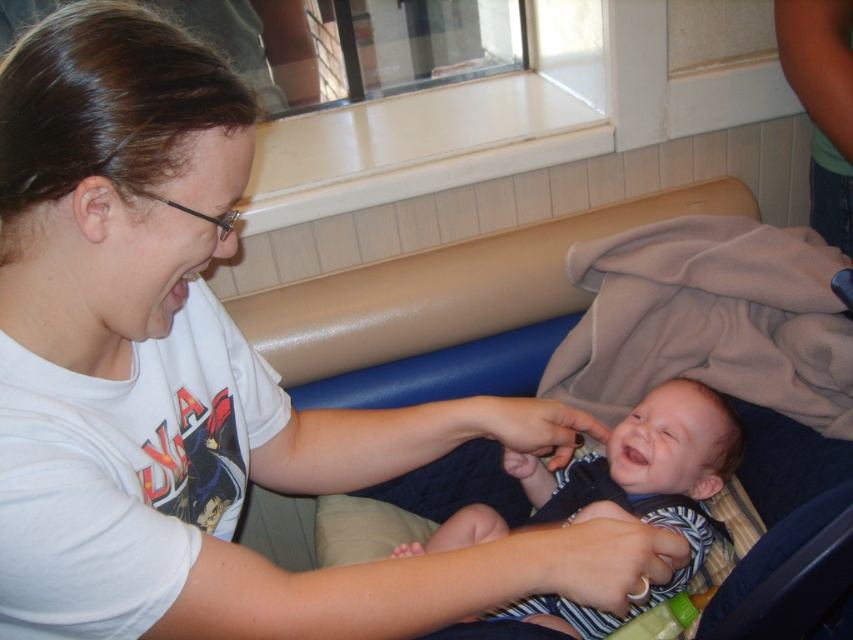
Measure the distance between dark blue fabric baby carriage at center and camera.

A distance of 1.13 meters exists between dark blue fabric baby carriage at center and camera.

Is point (592, 360) positioned in front of point (704, 404)?

That is False.

Where is `dark blue fabric baby carriage at center`? The height and width of the screenshot is (640, 853). dark blue fabric baby carriage at center is located at coordinates (721, 340).